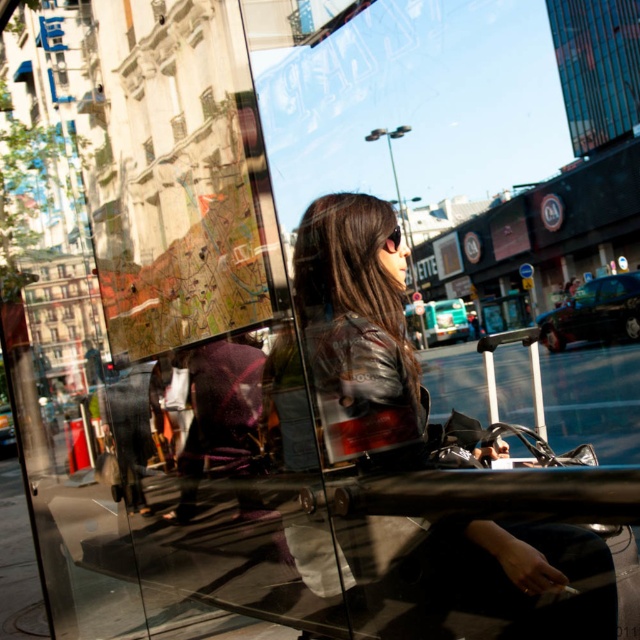
Question: Does leather jacket at center appear on the left side of black plastic sunglasses at center?

Choices:
 (A) yes
 (B) no

Answer: (B)

Question: Which point is closer to the camera?

Choices:
 (A) black plastic sunglasses at center
 (B) leather jacket at center

Answer: (B)

Question: Is leather jacket at center to the left of black plastic sunglasses at center from the viewer's perspective?

Choices:
 (A) yes
 (B) no

Answer: (B)

Question: Which point appears closest to the camera in this image?

Choices:
 (A) (394, 240)
 (B) (332, 218)

Answer: (B)

Question: Where is leather jacket at center located in relation to black plastic sunglasses at center in the image?

Choices:
 (A) below
 (B) above

Answer: (A)